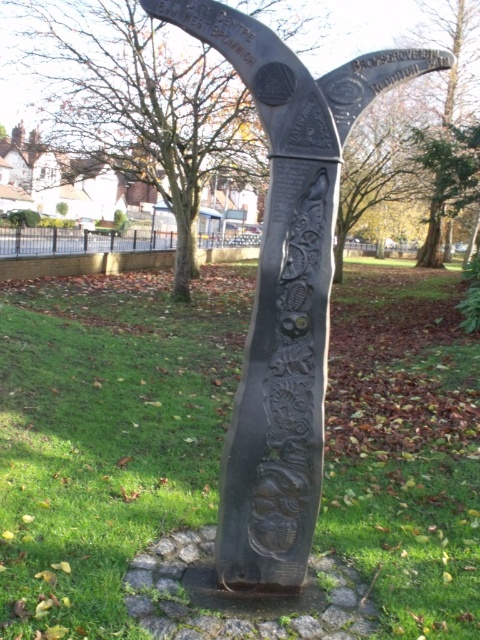
Question: Can you confirm if green grass at center is positioned above black polished stone sculpture at center?

Choices:
 (A) no
 (B) yes

Answer: (A)

Question: Which point is farther to the camera?

Choices:
 (A) green grass at center
 (B) black polished stone sculpture at center

Answer: (B)

Question: Among these points, which one is nearest to the camera?

Choices:
 (A) (253, 500)
 (B) (428, 364)

Answer: (A)

Question: In this image, where is green grass at center located relative to black polished stone sculpture at center?

Choices:
 (A) below
 (B) above

Answer: (A)

Question: Which point is farther to the camera?

Choices:
 (A) (308, 227)
 (B) (147, 513)

Answer: (B)

Question: Does green grass at center appear on the right side of black polished stone sculpture at center?

Choices:
 (A) no
 (B) yes

Answer: (A)